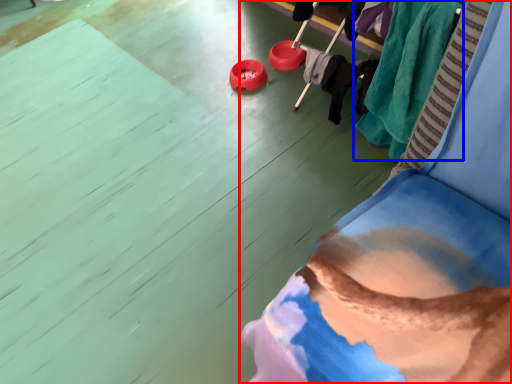
Question: Among these objects, which one is nearest to the camera, furniture (highlighted by a red box) or clothing (highlighted by a blue box)?

Choices:
 (A) furniture
 (B) clothing

Answer: (A)